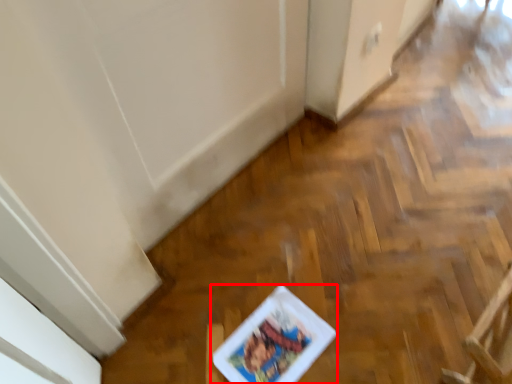
Question: From the image's perspective, considering the relative positions of comic book (annotated by the red box) and armchair in the image provided, where is comic book (annotated by the red box) located with respect to the staircase?

Choices:
 (A) above
 (B) below

Answer: (B)